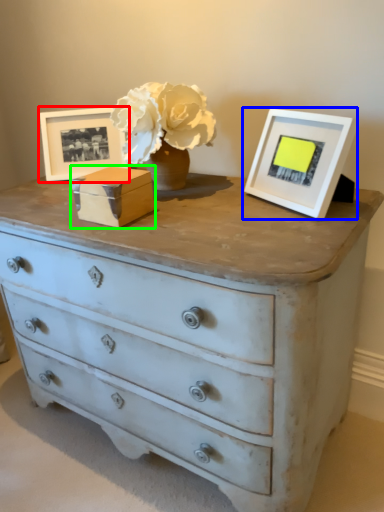
Question: Considering the real-world distances, which object is closest to picture frame (highlighted by a red box)? picture frame (highlighted by a blue box) or box (highlighted by a green box).

Choices:
 (A) picture frame
 (B) box

Answer: (B)